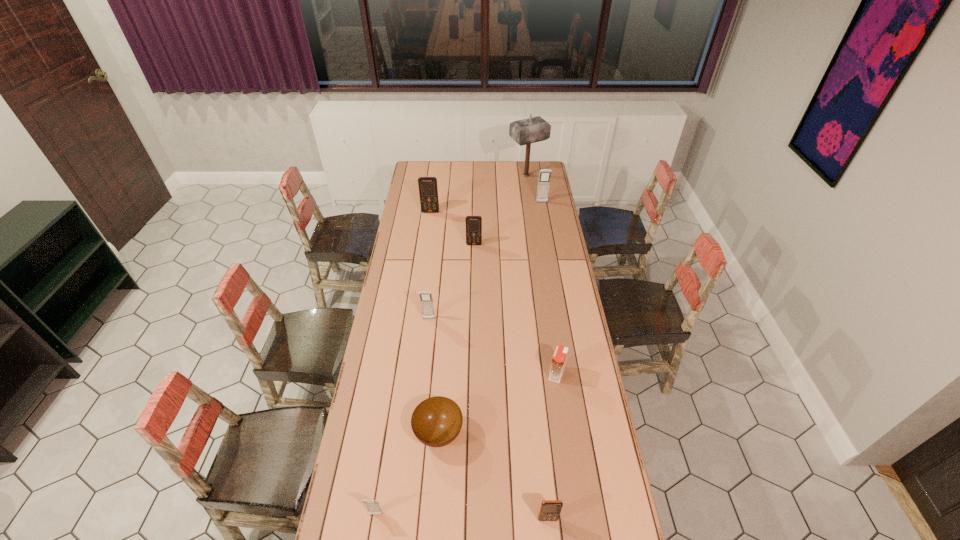
Select which orange cellular telephone appears as the second closest to the biggest orange cellular telephone. Please provide its 2D coordinates. Your answer should be formatted as a tuple, i.e. [(x, y)], where the tuple contains the x and y coordinates of a point satisfying the conditions above.

[(550, 510)]

Image resolution: width=960 pixels, height=540 pixels. I want to click on the closest orange cellular telephone to the nearest gray cellular telephone, so click(x=550, y=510).

Find the location of a particular element. The image size is (960, 540). free point that satisfies the following two spatial constraints: 1. on the screen of the orange orange juice; 2. on the right side of the second orange cellular telephone from left to right is located at coordinates (472, 374).

Find the location of a particular element. free spot that satisfies the following two spatial constraints: 1. on the screen of the fourth nearest object; 2. on the left side of the second farthest cellular telephone is located at coordinates (408, 374).

In order to click on vacant space that satisfies the following two spatial constraints: 1. on the screen of the fourth nearest object; 2. on the left side of the fourth cellular telephone from left to right in this screenshot , I will do `click(472, 374)`.